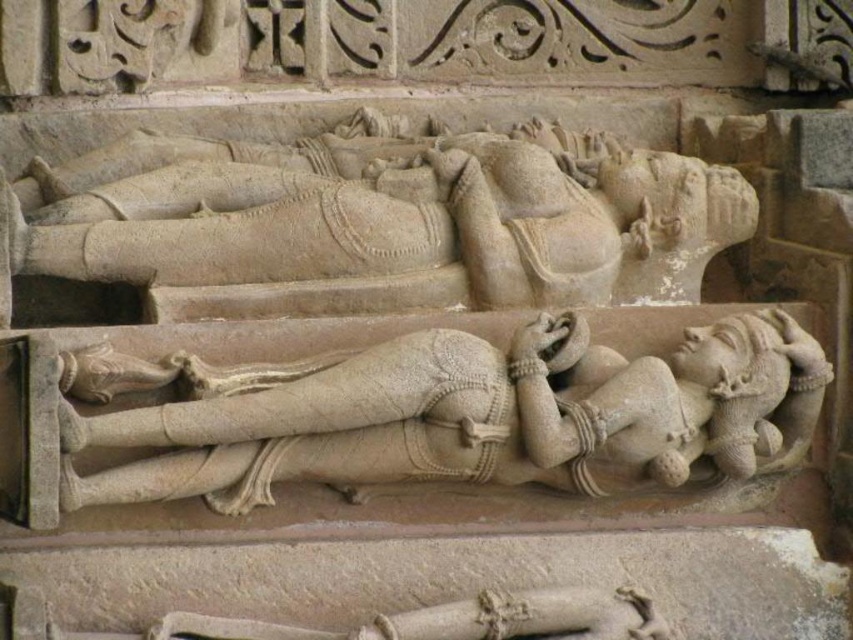
Question: Is stone statue at center above smooth beige statue at center?

Choices:
 (A) no
 (B) yes

Answer: (B)

Question: Considering the relative positions of stone statue at center and smooth beige statue at center in the image provided, where is stone statue at center located with respect to smooth beige statue at center?

Choices:
 (A) left
 (B) right

Answer: (A)

Question: Which point appears farthest from the camera in this image?

Choices:
 (A) coord(383,436)
 (B) coord(202,168)

Answer: (B)

Question: Where is stone statue at center located in relation to smooth beige statue at center in the image?

Choices:
 (A) above
 (B) below

Answer: (A)